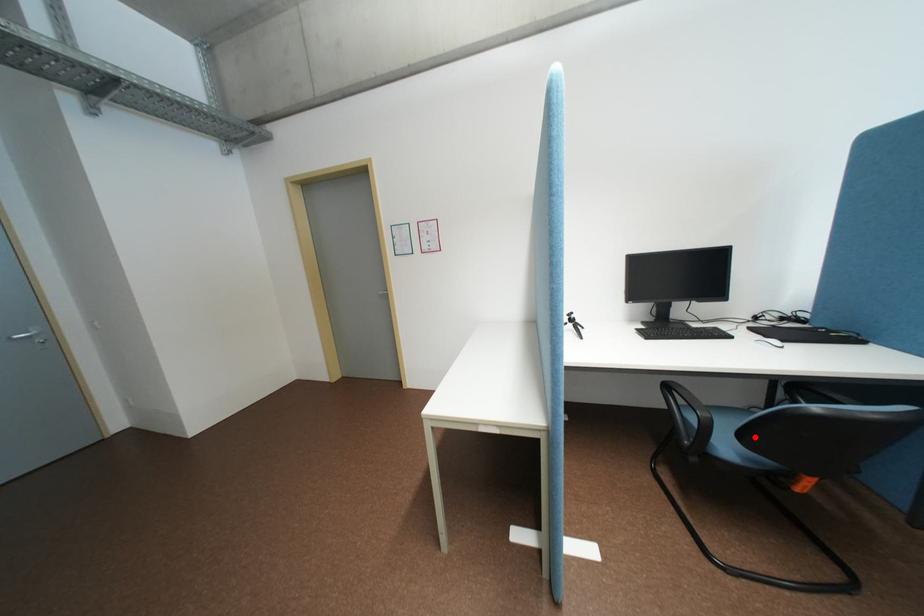
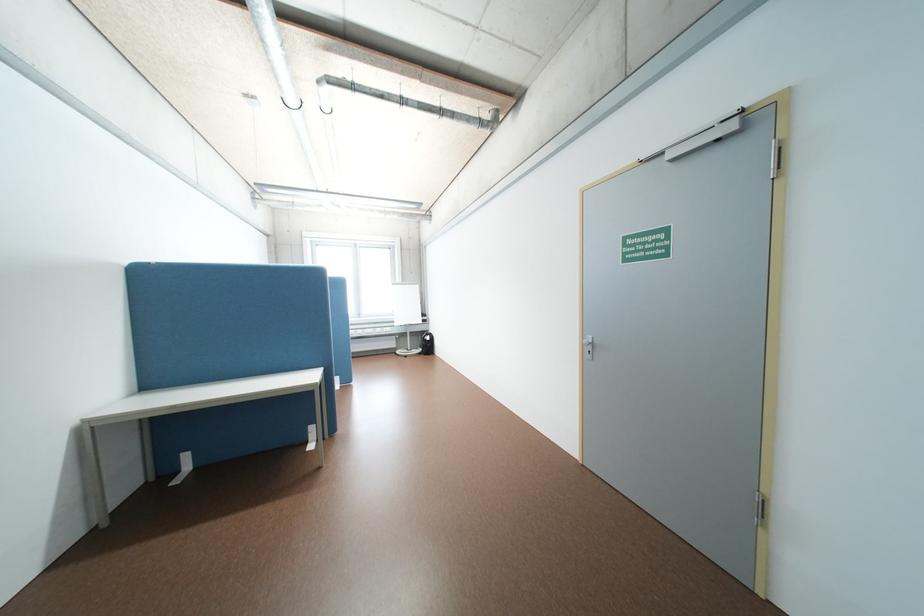
Question: I am providing you with two images of the same scene from different viewpoints. A red point is marked on the first image. Can you still see the location of the red point in image 2?

Choices:
 (A) Yes
 (B) No

Answer: (B)